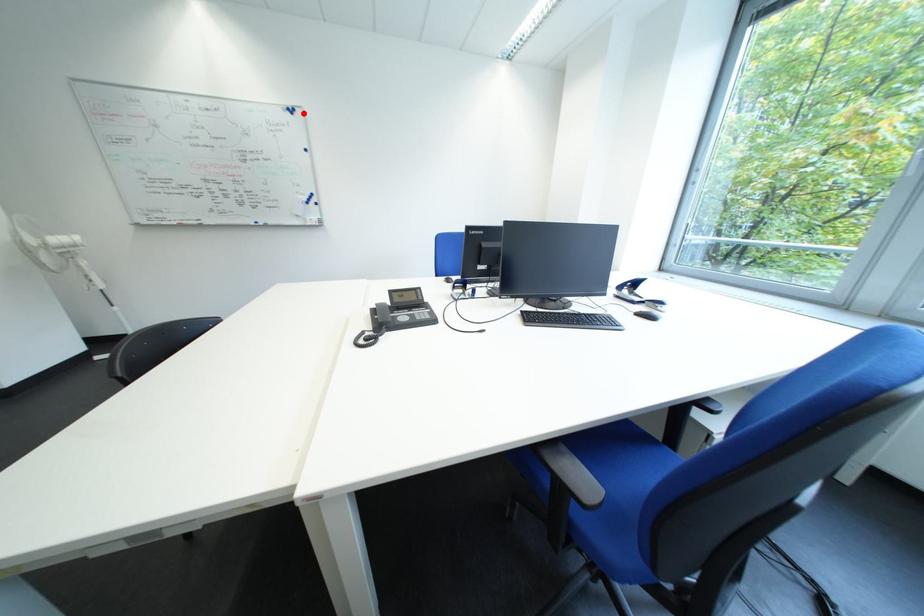
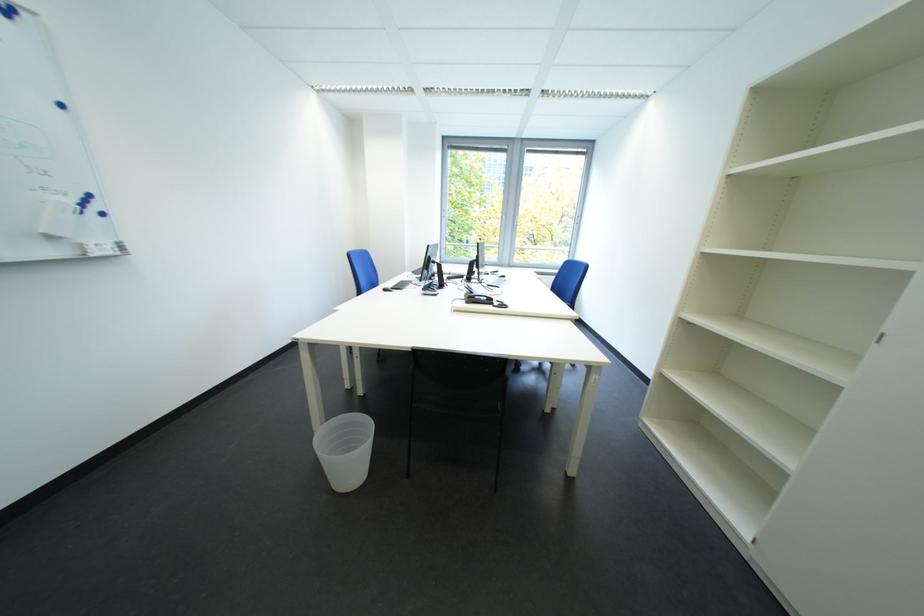
Locate, in the second image, the point that corresponds to the highlighted location in the first image.

(17, 12)